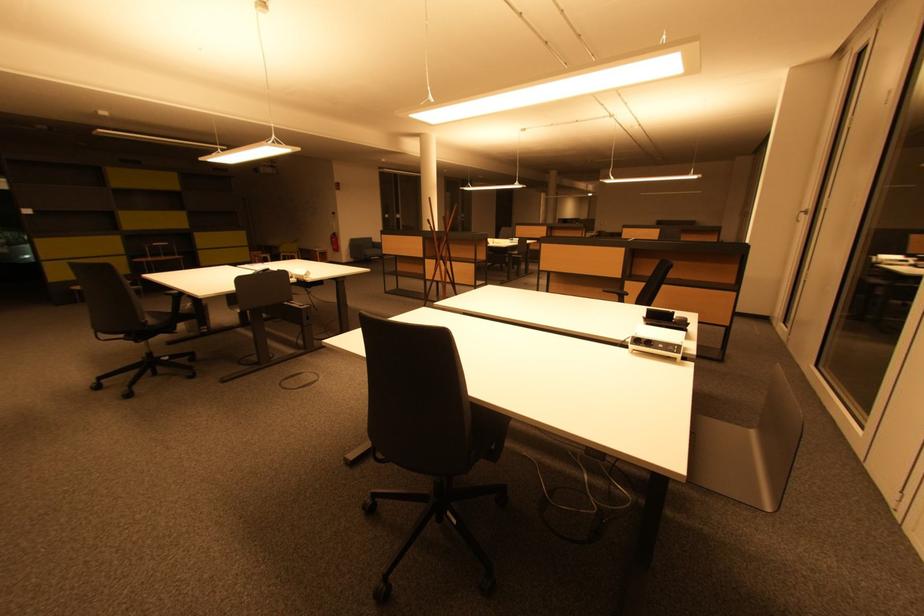
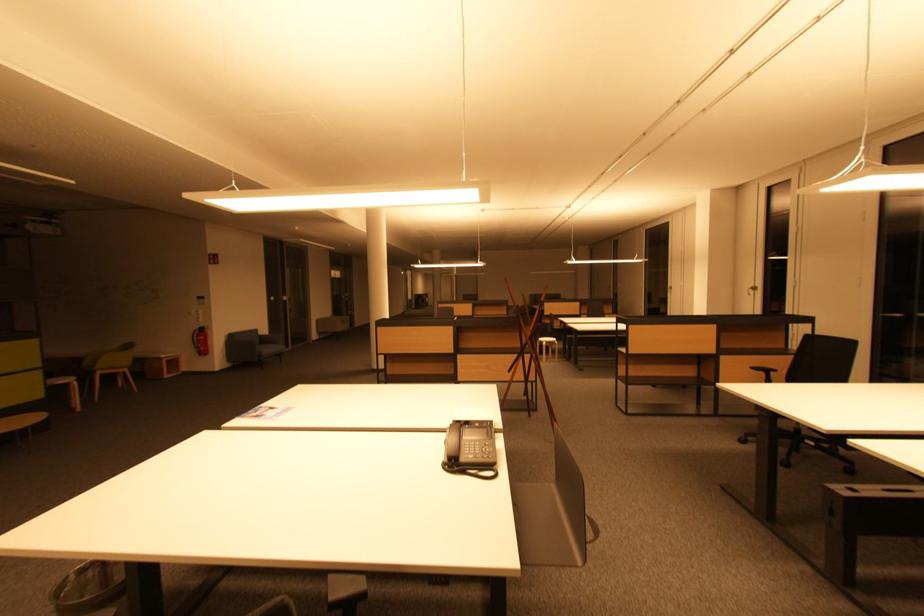
The point at (x=374, y=254) is marked in the first image. Where is the corresponding point in the second image?

(272, 352)